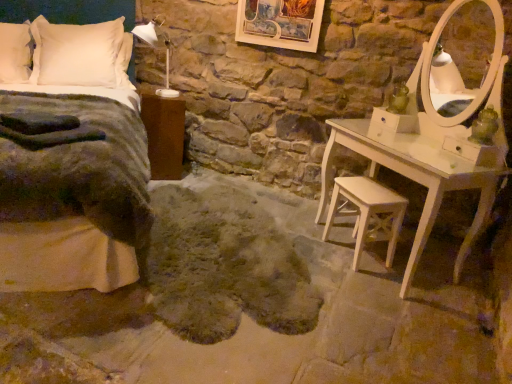
Question: Is fuzzy gray rug at center positioned in front of wooden picture frame at upper center?

Choices:
 (A) no
 (B) yes

Answer: (B)

Question: From the image's perspective, is fuzzy gray rug at center on top of wooden picture frame at upper center?

Choices:
 (A) yes
 (B) no

Answer: (B)

Question: From the image's perspective, would you say fuzzy gray rug at center is shown under wooden picture frame at upper center?

Choices:
 (A) yes
 (B) no

Answer: (A)

Question: Is fuzzy gray rug at center at the right side of wooden picture frame at upper center?

Choices:
 (A) yes
 (B) no

Answer: (B)

Question: From a real-world perspective, is fuzzy gray rug at center physically above wooden picture frame at upper center?

Choices:
 (A) no
 (B) yes

Answer: (A)

Question: Is point (24, 72) positioned closer to the camera than point (133, 124)?

Choices:
 (A) farther
 (B) closer

Answer: (A)

Question: In terms of width, does white soft pillow at upper left, placed as the 1th pillow when sorted from left to right, look wider or thinner when compared to velvet grey blanket at left?

Choices:
 (A) wide
 (B) thin

Answer: (B)

Question: From the image's perspective, is white soft pillow at upper left, placed as the 1th pillow when sorted from left to right, located above or below velvet grey blanket at left?

Choices:
 (A) above
 (B) below

Answer: (A)

Question: Is white soft pillow at upper left, placed as the 2th pillow when sorted from right to left, in front of or behind velvet grey blanket at left in the image?

Choices:
 (A) front
 (B) behind

Answer: (B)

Question: Is white soft pillow at upper left, arranged as the first pillow when viewed from the right, spatially inside fuzzy gray rug at center, or outside of it?

Choices:
 (A) inside
 (B) outside

Answer: (B)

Question: Does point (76, 79) appear closer or farther from the camera than point (272, 292)?

Choices:
 (A) farther
 (B) closer

Answer: (A)

Question: Is white soft pillow at upper left, which is the second pillow in left-to-right order, bigger or smaller than fuzzy gray rug at center?

Choices:
 (A) big
 (B) small

Answer: (A)

Question: Would you say white soft pillow at upper left, arranged as the first pillow when viewed from the right, is to the left or to the right of fuzzy gray rug at center in the picture?

Choices:
 (A) right
 (B) left

Answer: (B)

Question: Is wooden picture frame at upper center in front of or behind brown wood nightstand at left in the image?

Choices:
 (A) front
 (B) behind

Answer: (A)

Question: In terms of size, does wooden picture frame at upper center appear bigger or smaller than brown wood nightstand at left?

Choices:
 (A) small
 (B) big

Answer: (A)